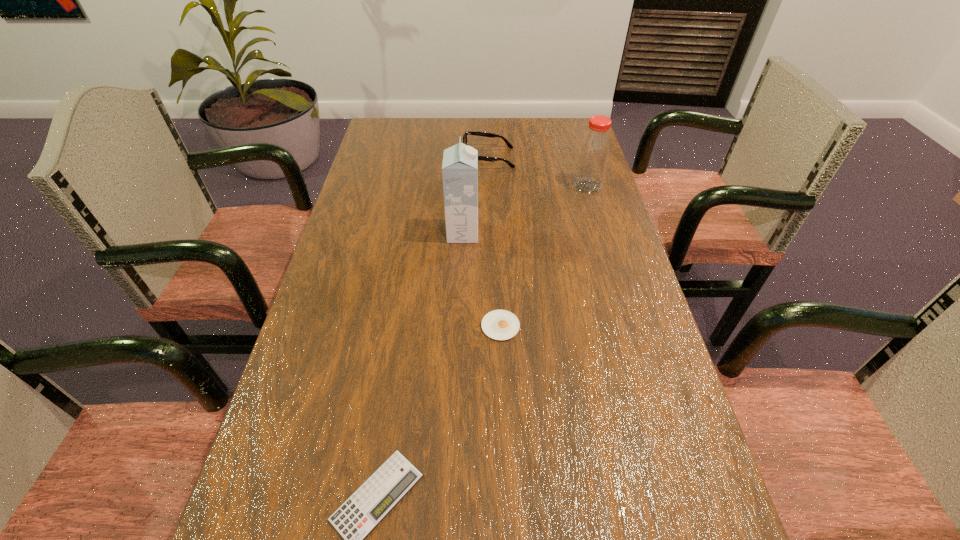
What are the coordinates of `the tallest object` in the screenshot? It's located at (460, 162).

This screenshot has width=960, height=540. I want to click on the third nearest object, so click(460, 162).

The height and width of the screenshot is (540, 960). Identify the location of the second tallest object. (594, 150).

The height and width of the screenshot is (540, 960). I want to click on the rightmost object, so click(x=594, y=150).

At what (x,y) coordinates should I click in order to perform the action: click on the third tallest object. Please return your answer as a coordinate pair (x, y). The height and width of the screenshot is (540, 960). Looking at the image, I should click on tap(483, 158).

The width and height of the screenshot is (960, 540). What are the coordinates of `the farthest object` in the screenshot? It's located at (483, 158).

Where is `the fourth tallest object`? This screenshot has width=960, height=540. the fourth tallest object is located at coordinates (499, 324).

This screenshot has height=540, width=960. In order to click on egg yolk in this screenshot , I will do `click(499, 324)`.

This screenshot has height=540, width=960. Identify the location of blank space located 0.230m on the front label of the carton. (564, 233).

Image resolution: width=960 pixels, height=540 pixels. Find the location of `free space located 0.240m on the back of the fourth shortest object`. free space located 0.240m on the back of the fourth shortest object is located at coordinates (574, 139).